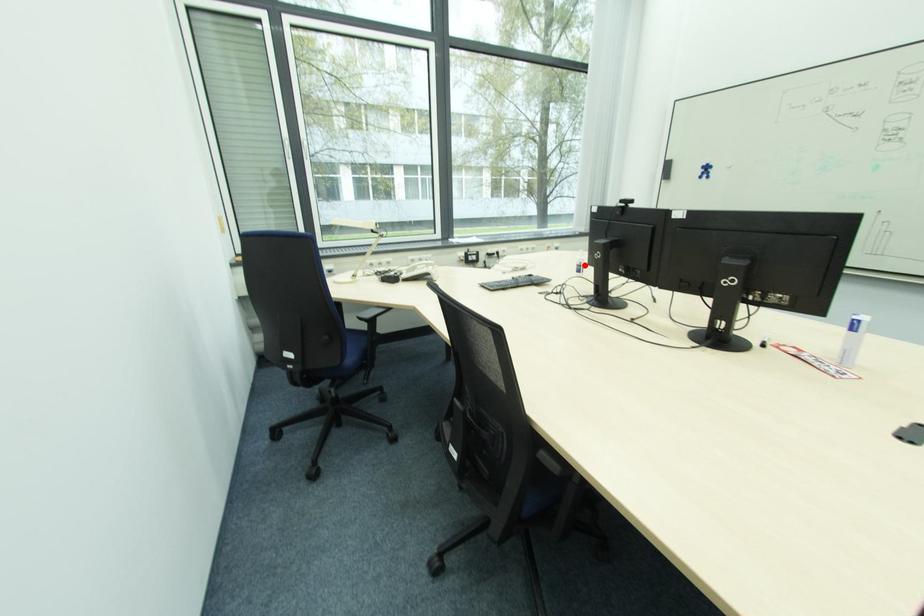
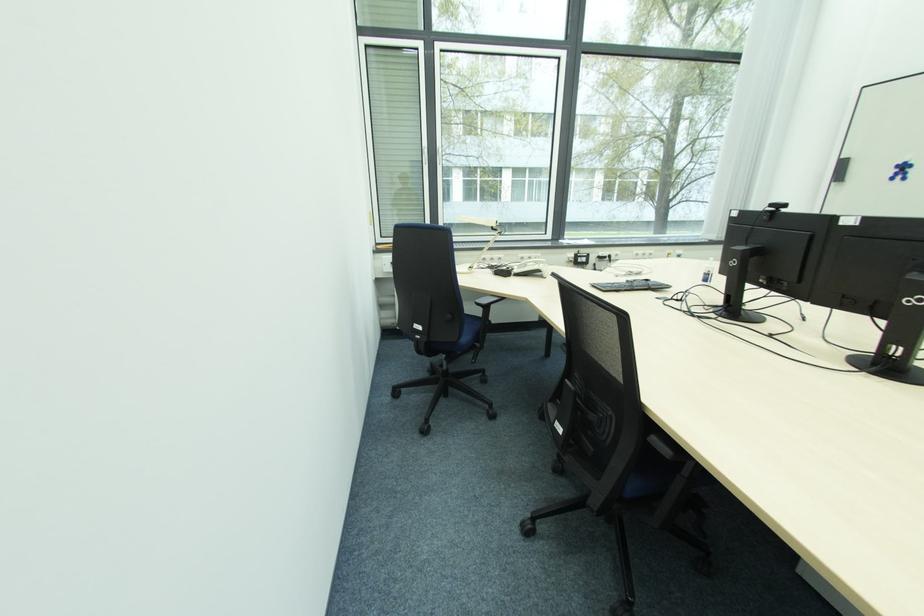
The point at the highlighted location is marked in the first image. Where is the corresponding point in the second image?

(712, 274)